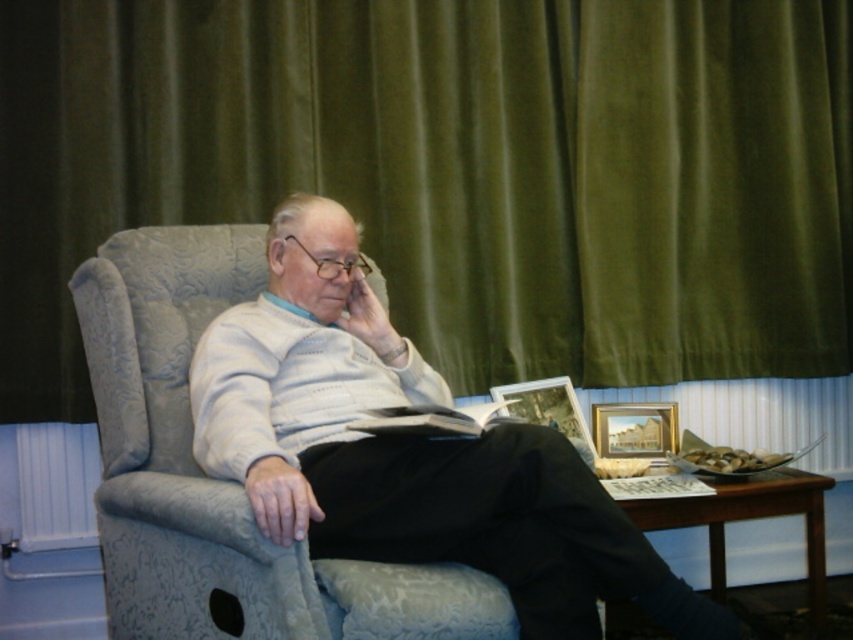
You are an interior designer planning to place a 24 inch wide decorative shelf between the velvet green curtain at upper center and the wooden picture frame at lower right. Based on the scene, will the shelf fit without overlapping either object?

The distance between the velvet green curtain at upper center and the wooden picture frame at lower right is 24.43 inches. Since the shelf is 24 inches wide, there is enough space for it to fit without overlapping either object.

You are an interior designer planning to hang a small painting. You see the point marked at (454, 172) which is on the velvet green curtain at upper center. Where should you place the painting to ensure it hangs above the velvet green curtain at upper center?

The point marked at (454, 172) is on the velvet green curtain at upper center. To hang the painting above it, place the painting higher than this point so it is positioned above the velvet green curtain at upper center.

You are an interior designer planning to place a new rectangular coffee table between the velvet green curtain at upper center and the light gray fabric chair at center. The table must fit snugly without touching either object. Based on their widths, can you determine if this placement is feasible?

The velvet green curtain at upper center might be wider than light gray fabric chair at center, so it is uncertain if the coffee table will fit snugly between them without touching either object. Further measurements are needed to confirm.